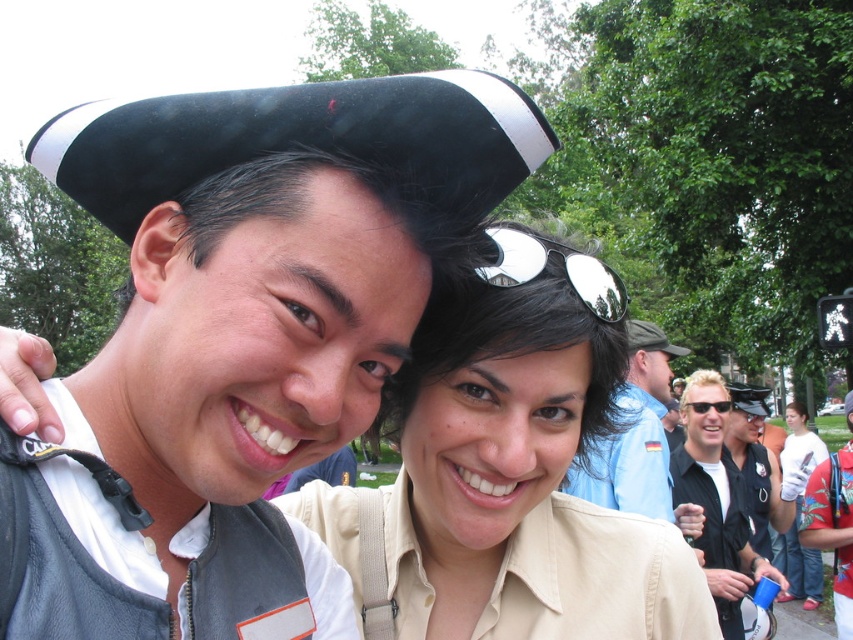
You are organizing a group photo and need to arrange two people wearing the matte khaki shirt at center and the matte beige shirt at center side by side. Given that the total space available for both is 1.5 meters, will they fit comfortably if they stand next to each other?

The matte khaki shirt at center has a larger width than the matte beige shirt at center. Since the total space available is 1.5 meters, but the combined width of both shirts might exceed the available space, they may not fit comfortably. It is recommended to check the exact measurements or adjust their positions to ensure enough space.

You are taking a photo of two people in the center of the image. The people are wearing a matte khaki shirt at center and a matte beige shirt at center. Which one is positioned to the left?

The matte khaki shirt at center is positioned to the left of the matte beige shirt at center.